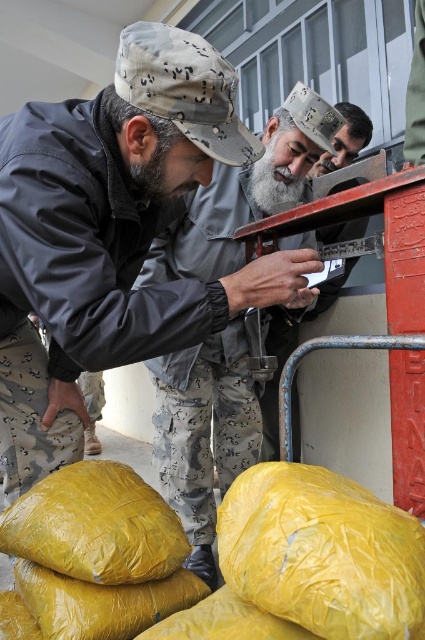
Which of these two, yellow plastic sack at lower left or graywoollybeard at center, stands taller?

Standing taller between the two is graywoollybeard at center.

What do you see at coordinates (96, 525) in the screenshot? I see `yellow plastic sack at lower left` at bounding box center [96, 525].

The width and height of the screenshot is (425, 640). In order to click on yellow plastic sack at lower left in this screenshot , I will do `click(96, 525)`.

This screenshot has height=640, width=425. Describe the element at coordinates (275, 381) in the screenshot. I see `bearded man at center` at that location.

Does bearded man at center have a greater width compared to graywoollybeard at center?

Yes, bearded man at center is wider than graywoollybeard at center.

The width and height of the screenshot is (425, 640). Describe the element at coordinates (275, 381) in the screenshot. I see `bearded man at center` at that location.

What are the coordinates of `bearded man at center` in the screenshot? It's located at (275, 381).

Between yellow plastic sack at lower left and bearded man at center, which one appears on the left side from the viewer's perspective?

yellow plastic sack at lower left

Is yellow plastic sack at lower left closer to the viewer compared to bearded man at center?

Yes.

The image size is (425, 640). I want to click on yellow plastic sack at lower left, so click(x=96, y=525).